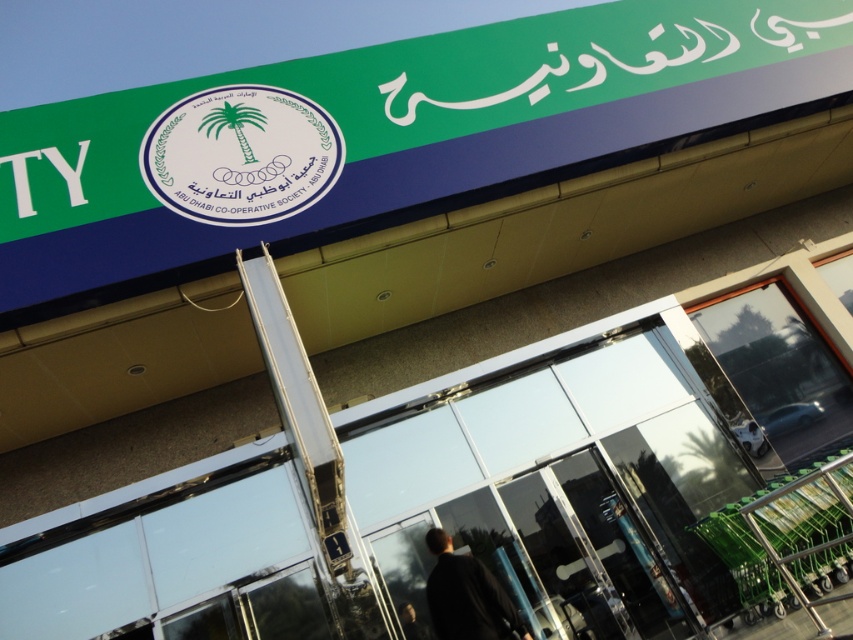
You are a delivery person approaching the building entrance. You need to place a package on the ground near the black matte jacket at lower center. Where should you place the package in relation to the white glossy emblem at center?

The white glossy emblem at center is located above the black matte jacket at lower center, so you should place the package below the white glossy emblem at center to be near the black matte jacket at lower center.

You are standing in front of the building and want to take a photo of both the signboard and the entrance. Which point, point (703, 84) or point (447, 538), is closer to your camera lens?

Point (447, 538) is closer to the camera lens because it is less further away than point (703, 84).